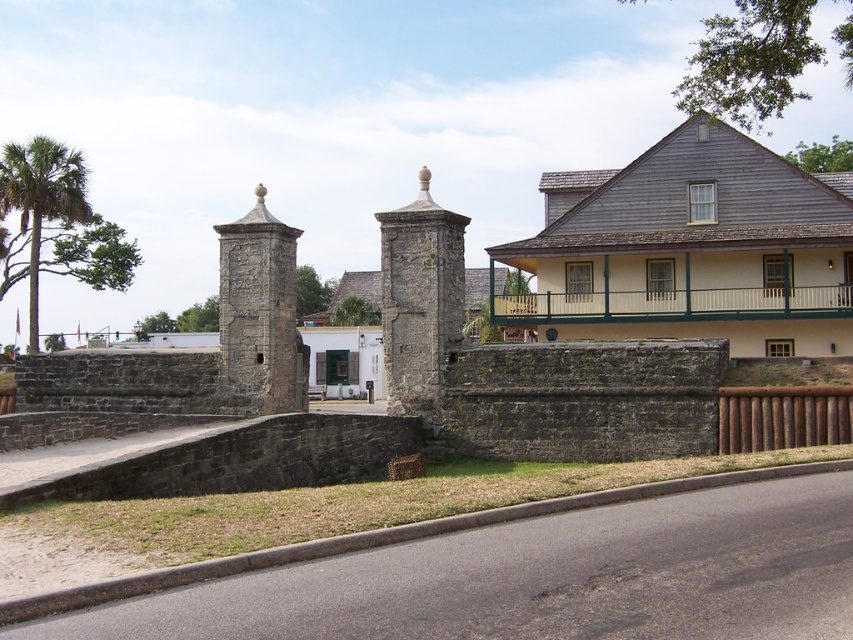
Question: Is stone textured gate at center further to the viewer compared to rustic stone tower at left?

Choices:
 (A) no
 (B) yes

Answer: (A)

Question: Is stone textured gate at center positioned behind rustic stone tower at left?

Choices:
 (A) yes
 (B) no

Answer: (B)

Question: Which object appears closest to the camera in this image?

Choices:
 (A) rustic stone tower at left
 (B) stone textured gate at center

Answer: (B)

Question: Does stone textured gate at center appear over rustic stone tower at left?

Choices:
 (A) yes
 (B) no

Answer: (A)